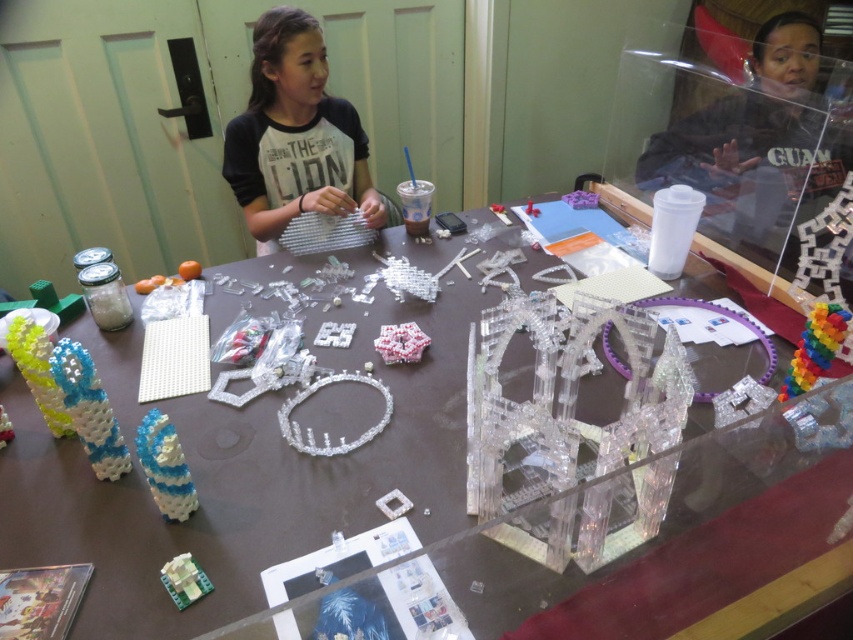
Looking at this image, is translucent plastic building at lower left positioned at the back of translucent plastic cube at center?

No, it is in front of translucent plastic cube at center.

Between point (190, 579) and point (416, 324), which one is positioned in front?

Positioned in front is point (190, 579).

Between point (178, 577) and point (412, 323), which one is positioned in front?

Point (178, 577) is in front.

Identify the location of translucent plastic building at lower left. (184, 579).

Is clear plastic table at center to the right of rainbow plastic toy at right from the viewer's perspective?

Incorrect, clear plastic table at center is not on the right side of rainbow plastic toy at right.

How far apart are clear plastic table at center and rainbow plastic toy at right?

The distance of clear plastic table at center from rainbow plastic toy at right is 22.24 inches.

In order to click on clear plastic table at center in this screenshot , I will do `click(230, 496)`.

This screenshot has width=853, height=640. What are the coordinates of `clear plastic table at center` in the screenshot? It's located at (230, 496).

Does point (119, 520) come in front of point (412, 349)?

Yes, point (119, 520) is closer to viewer.

Who is more forward, (416, 388) or (408, 324)?

Positioned in front is point (416, 388).

Locate an element on the screen. clear plastic table at center is located at coordinates (230, 496).